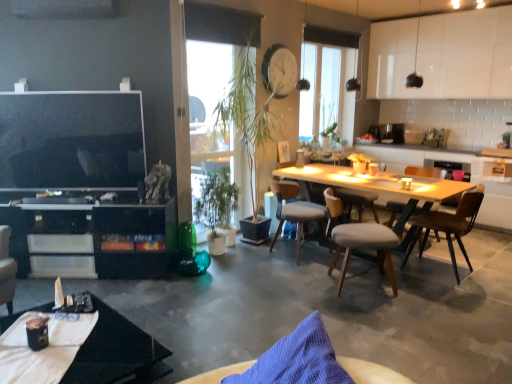
Question: Should I look upward or downward to see brown wooden chair at center, the fourth chair viewed from the left?

Choices:
 (A) up
 (B) down

Answer: (B)

Question: Can you confirm if black glass coffee table at lower left is positioned to the right of light gray fabric chair at center, the 3th chair when ordered from right to left?

Choices:
 (A) no
 (B) yes

Answer: (A)

Question: Can you confirm if black glass coffee table at lower left is positioned to the left of light gray fabric chair at center, which is the 4th chair in front-to-back order?

Choices:
 (A) no
 (B) yes

Answer: (B)

Question: Is black glass coffee table at lower left oriented away from light gray fabric chair at center, acting as the 2th chair starting from the left?

Choices:
 (A) no
 (B) yes

Answer: (A)

Question: Does black glass coffee table at lower left have a lesser height compared to light gray fabric chair at center, which is the 4th chair in front-to-back order?

Choices:
 (A) yes
 (B) no

Answer: (A)

Question: Is black glass coffee table at lower left oriented towards light gray fabric chair at center, which is the 4th chair in front-to-back order?

Choices:
 (A) no
 (B) yes

Answer: (A)

Question: From the image's perspective, is black glass coffee table at lower left on top of light gray fabric chair at center, which is the first chair in back-to-front order?

Choices:
 (A) no
 (B) yes

Answer: (A)

Question: Is transparent glass window at center oriented towards beige fabric chair at center, the 3th chair viewed from the left?

Choices:
 (A) no
 (B) yes

Answer: (A)

Question: Can beige fabric chair at center, the second chair viewed from the right, be found inside transparent glass window at center?

Choices:
 (A) yes
 (B) no

Answer: (B)

Question: Considering the relative positions of transparent glass window at center and beige fabric chair at center, arranged as the third chair when viewed from the back, in the image provided, is transparent glass window at center behind beige fabric chair at center, arranged as the third chair when viewed from the back,?

Choices:
 (A) no
 (B) yes

Answer: (B)

Question: Considering the relative sizes of transparent glass window at center and beige fabric chair at center, the 3th chair viewed from the left, in the image provided, is transparent glass window at center shorter than beige fabric chair at center, the 3th chair viewed from the left,?

Choices:
 (A) yes
 (B) no

Answer: (B)

Question: Would you say transparent glass window at center is outside beige fabric chair at center, the 3th chair viewed from the left?

Choices:
 (A) no
 (B) yes

Answer: (B)

Question: Does transparent glass window at center lie in front of beige fabric chair at center, which is the 2th chair in front-to-back order?

Choices:
 (A) yes
 (B) no

Answer: (B)

Question: Does black glass coffee table at lower left have a greater width compared to transparent glass window at center?

Choices:
 (A) no
 (B) yes

Answer: (B)